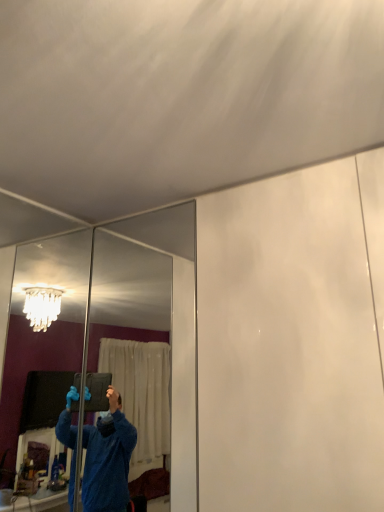
In the scene shown: What is the approximate width of clear glass mirror at left, positioned as the 2th mirror in right-to-left order?

The width of clear glass mirror at left, positioned as the 2th mirror in right-to-left order, is 2.58 centimeters.

Find the location of a particular element. The image size is (384, 512). clear glass mirror at left, positioned as the 2th mirror in right-to-left order is located at coordinates (52, 323).

The width and height of the screenshot is (384, 512). Describe the element at coordinates (52, 323) in the screenshot. I see `clear glass mirror at left, the 1th mirror in the left-to-right sequence` at that location.

The width and height of the screenshot is (384, 512). What do you see at coordinates (181, 378) in the screenshot? I see `clear glass mirror at center, the first mirror when ordered from right to left` at bounding box center [181, 378].

How much space does clear glass mirror at center, the first mirror when ordered from right to left, occupy vertically?

clear glass mirror at center, the first mirror when ordered from right to left, is 98.18 centimeters in height.

Identify the location of clear glass mirror at center, the first mirror when ordered from right to left. (181, 378).

The height and width of the screenshot is (512, 384). I want to click on clear glass mirror at left, positioned as the 2th mirror in right-to-left order, so click(52, 323).

Considering the positions of objects clear glass mirror at left, the 1th mirror in the left-to-right sequence, and clear glass mirror at center, the first mirror when ordered from right to left, in the image provided, who is more to the right, clear glass mirror at left, the 1th mirror in the left-to-right sequence, or clear glass mirror at center, the first mirror when ordered from right to left,?

clear glass mirror at center, the first mirror when ordered from right to left.

Who is more distant, clear glass mirror at left, the 1th mirror in the left-to-right sequence, or clear glass mirror at center, arranged as the second mirror when viewed from the left?

clear glass mirror at center, arranged as the second mirror when viewed from the left.

Based on the photo, which point is more distant from viewer, (63, 331) or (183, 266)?

Point (63, 331)

From the image's perspective, is clear glass mirror at left, positioned as the 2th mirror in right-to-left order, positioned above or below clear glass mirror at center, the first mirror when ordered from right to left?

Based on their image positions, clear glass mirror at left, positioned as the 2th mirror in right-to-left order, is located above clear glass mirror at center, the first mirror when ordered from right to left.

From the picture: From a real-world perspective, which object rests below the other?

In real-world perspective, clear glass mirror at center, arranged as the second mirror when viewed from the left, is lower.

Looking at this image, considering the relative sizes of clear glass mirror at left, the 1th mirror in the left-to-right sequence, and clear glass mirror at center, arranged as the second mirror when viewed from the left, in the image provided, is clear glass mirror at left, the 1th mirror in the left-to-right sequence, wider than clear glass mirror at center, arranged as the second mirror when viewed from the left,?

In fact, clear glass mirror at left, the 1th mirror in the left-to-right sequence, might be narrower than clear glass mirror at center, arranged as the second mirror when viewed from the left.

In terms of height, does clear glass mirror at left, the 1th mirror in the left-to-right sequence, look taller or shorter compared to clear glass mirror at center, the first mirror when ordered from right to left?

Considering their sizes, clear glass mirror at left, the 1th mirror in the left-to-right sequence, has more height than clear glass mirror at center, the first mirror when ordered from right to left.

Considering the sizes of objects clear glass mirror at left, positioned as the 2th mirror in right-to-left order, and clear glass mirror at center, the first mirror when ordered from right to left, in the image provided, who is bigger, clear glass mirror at left, positioned as the 2th mirror in right-to-left order, or clear glass mirror at center, the first mirror when ordered from right to left,?

clear glass mirror at center, the first mirror when ordered from right to left.

Is clear glass mirror at left, the 1th mirror in the left-to-right sequence, surrounding clear glass mirror at center, arranged as the second mirror when viewed from the left?

Definitely not — clear glass mirror at center, arranged as the second mirror when viewed from the left, is not inside clear glass mirror at left, the 1th mirror in the left-to-right sequence.

Is there a large distance between clear glass mirror at left, positioned as the 2th mirror in right-to-left order, and clear glass mirror at center, arranged as the second mirror when viewed from the left?

Yes.

Is clear glass mirror at left, positioned as the 2th mirror in right-to-left order, oriented towards clear glass mirror at center, the first mirror when ordered from right to left?

Yes, clear glass mirror at left, positioned as the 2th mirror in right-to-left order, is oriented towards clear glass mirror at center, the first mirror when ordered from right to left.

How distant is clear glass mirror at left, positioned as the 2th mirror in right-to-left order, from clear glass mirror at center, the first mirror when ordered from right to left?

clear glass mirror at left, positioned as the 2th mirror in right-to-left order, and clear glass mirror at center, the first mirror when ordered from right to left, are 2.85 meters apart.

The width and height of the screenshot is (384, 512). In order to click on mirror in front of the clear glass mirror at center, the first mirror when ordered from right to left in this screenshot , I will do `click(52, 323)`.

Is clear glass mirror at center, arranged as the second mirror when viewed from the left, to the left or to the right of clear glass mirror at left, positioned as the 2th mirror in right-to-left order, in the image?

clear glass mirror at center, arranged as the second mirror when viewed from the left, is to the right of clear glass mirror at left, positioned as the 2th mirror in right-to-left order.

Relative to clear glass mirror at left, the 1th mirror in the left-to-right sequence, is clear glass mirror at center, arranged as the second mirror when viewed from the left, in front or behind?

clear glass mirror at center, arranged as the second mirror when viewed from the left, is positioned farther from the viewer than clear glass mirror at left, the 1th mirror in the left-to-right sequence.

Is point (187, 403) farther from camera compared to point (11, 424)?

No, it is in front of (11, 424).

Consider the image. From the image's perspective, which one is positioned lower, clear glass mirror at center, the first mirror when ordered from right to left, or clear glass mirror at left, the 1th mirror in the left-to-right sequence?

From the image's view, clear glass mirror at center, the first mirror when ordered from right to left, is below.

From a real-world perspective, which is physically above, clear glass mirror at center, arranged as the second mirror when viewed from the left, or clear glass mirror at left, positioned as the 2th mirror in right-to-left order?

clear glass mirror at left, positioned as the 2th mirror in right-to-left order, from a real-world perspective.

Between clear glass mirror at center, the first mirror when ordered from right to left, and clear glass mirror at left, the 1th mirror in the left-to-right sequence, which one has smaller width?

Thinner between the two is clear glass mirror at left, the 1th mirror in the left-to-right sequence.

From the picture: Which of these two, clear glass mirror at center, the first mirror when ordered from right to left, or clear glass mirror at left, positioned as the 2th mirror in right-to-left order, stands shorter?

With less height is clear glass mirror at center, the first mirror when ordered from right to left.

Based on their sizes in the image, would you say clear glass mirror at center, arranged as the second mirror when viewed from the left, is bigger or smaller than clear glass mirror at left, positioned as the 2th mirror in right-to-left order?

In the image, clear glass mirror at center, arranged as the second mirror when viewed from the left, appears to be larger than clear glass mirror at left, positioned as the 2th mirror in right-to-left order.

Can clear glass mirror at left, the 1th mirror in the left-to-right sequence, be found inside clear glass mirror at center, arranged as the second mirror when viewed from the left?

No, clear glass mirror at left, the 1th mirror in the left-to-right sequence, is not inside clear glass mirror at center, arranged as the second mirror when viewed from the left.

Can you see clear glass mirror at center, arranged as the second mirror when viewed from the left, touching clear glass mirror at left, the 1th mirror in the left-to-right sequence?

No, clear glass mirror at center, arranged as the second mirror when viewed from the left, is not beside clear glass mirror at left, the 1th mirror in the left-to-right sequence.

Is clear glass mirror at center, arranged as the second mirror when viewed from the left, looking in the opposite direction of clear glass mirror at left, the 1th mirror in the left-to-right sequence?

No.

Locate an element on the screen. The image size is (384, 512). mirror to the right of clear glass mirror at left, the 1th mirror in the left-to-right sequence is located at coordinates tap(181, 378).

Where is `mirror above the clear glass mirror at center, the first mirror when ordered from right to left (from the image's perspective)`? The height and width of the screenshot is (512, 384). mirror above the clear glass mirror at center, the first mirror when ordered from right to left (from the image's perspective) is located at coordinates (52, 323).

You are a GUI agent. You are given a task and a screenshot of the screen. Output one action in this format:
    pyautogui.click(x=<x>, y=<y>)
    Task: Click on the mirror that appears behind the clear glass mirror at left, positioned as the 2th mirror in right-to-left order
    The width and height of the screenshot is (384, 512).
    Given the screenshot: What is the action you would take?
    pyautogui.click(x=181, y=378)